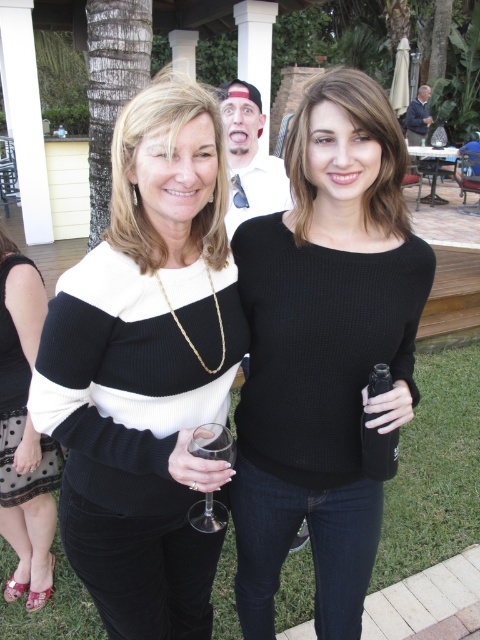
Question: Does black textured sweater at center lie behind clear glass wine glass at lower center?

Choices:
 (A) no
 (B) yes

Answer: (B)

Question: Which of the following is the farthest from the observer?

Choices:
 (A) black textured sweater at center
 (B) black ribbed sweater at center
 (C) black knitted sweater at center
 (D) clear glass wine glass at lower center

Answer: (A)

Question: Which is farther from the black ribbed sweater at center?

Choices:
 (A) black knitted sweater at center
 (B) black textured sweater at center

Answer: (B)

Question: Can you confirm if black textured sweater at center is positioned below clear glass wine glass at lower center?

Choices:
 (A) no
 (B) yes

Answer: (B)

Question: Does black knitted sweater at center come in front of clear glass wine glass at lower center?

Choices:
 (A) no
 (B) yes

Answer: (B)

Question: Estimate the real-world distances between objects in this image. Which object is closer to the black textured sweater at center?

Choices:
 (A) black ribbed sweater at center
 (B) black knitted sweater at center
 (C) clear glass wine glass at lower center

Answer: (B)